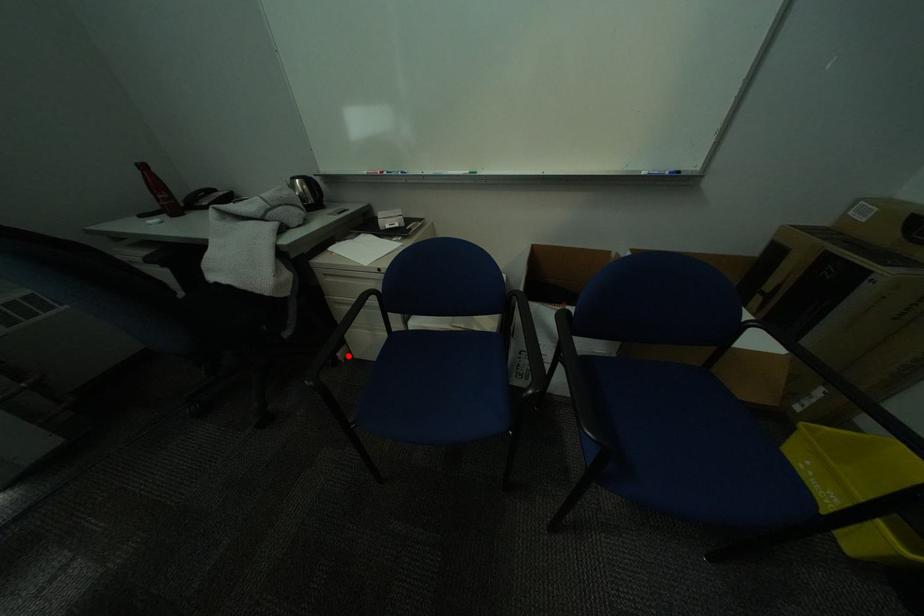
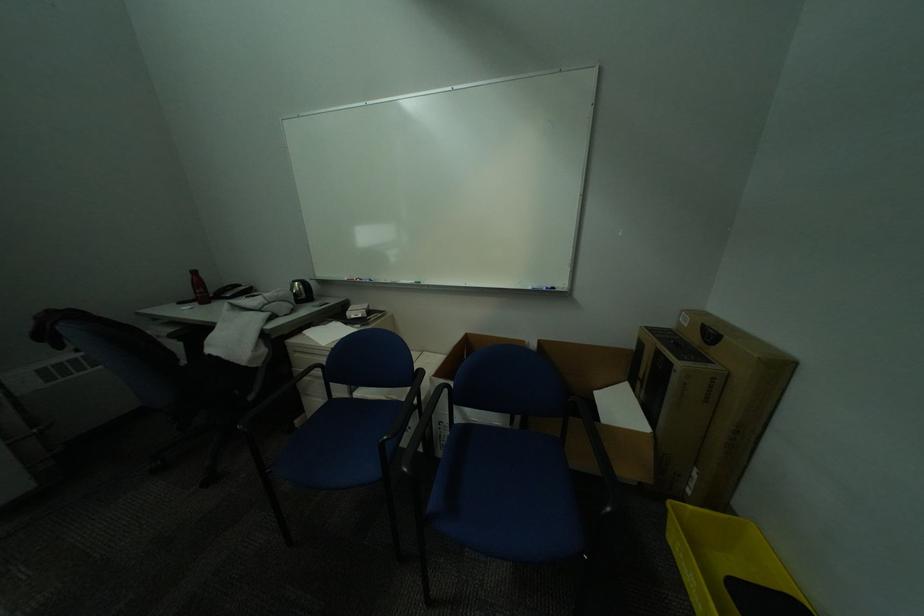
Question: I am providing you with two images of the same scene from different viewpoints. Image1 has a red point marked. In image2, the corresponding 3D location appears at what relative position? Reply with the corresponding letter.

Choices:
 (A) Closer
 (B) Farther

Answer: (B)